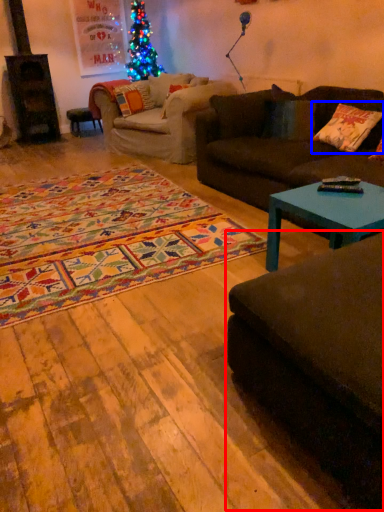
Question: Which of the following is the closest to the observer, studio couch (highlighted by a red box) or pillow (highlighted by a blue box)?

Choices:
 (A) studio couch
 (B) pillow

Answer: (A)